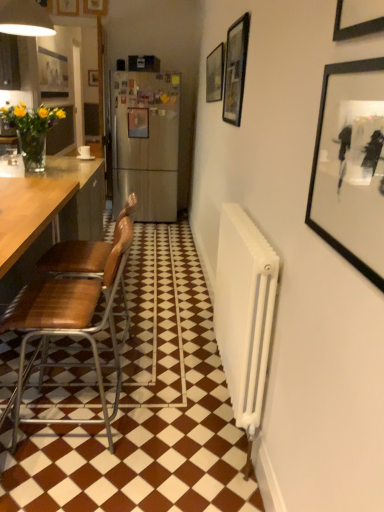
Question: In which direction should I rotate to look at matte black picture frame at upper center, acting as the second picture frame starting from the top?

Choices:
 (A) right
 (B) left

Answer: (B)

Question: Is metallic silver picture frame at center, which ranks as the 4th picture frame in front-to-back order, closer to the viewer compared to brown leather chair at left, positioned as the 1th chair in back-to-front order?

Choices:
 (A) no
 (B) yes

Answer: (A)

Question: From the image's perspective, does metallic silver picture frame at center, which is the 3th picture frame from left to right, appear lower than brown leather chair at left, positioned as the 2th chair in front-to-back order?

Choices:
 (A) no
 (B) yes

Answer: (A)

Question: Is there a large distance between metallic silver picture frame at center, the fourth picture frame from the bottom, and brown leather chair at left, positioned as the 2th chair in front-to-back order?

Choices:
 (A) yes
 (B) no

Answer: (A)

Question: Is metallic silver picture frame at center, the fourth picture frame from the bottom, aimed at brown leather chair at left, positioned as the 1th chair in back-to-front order?

Choices:
 (A) yes
 (B) no

Answer: (A)

Question: Does metallic silver picture frame at center, which ranks as the 4th picture frame in front-to-back order, appear on the right side of brown leather chair at left, positioned as the 2th chair in front-to-back order?

Choices:
 (A) no
 (B) yes

Answer: (A)

Question: From the image's perspective, is metallic silver picture frame at center, which is the 3th picture frame from left to right, over brown leather chair at left, positioned as the 1th chair in back-to-front order?

Choices:
 (A) no
 (B) yes

Answer: (B)

Question: Considering the relative sizes of brown leather chair at left, positioned as the 2th chair in front-to-back order, and brown leather chair at left, which is the second chair in back-to-front order, in the image provided, is brown leather chair at left, positioned as the 2th chair in front-to-back order, taller than brown leather chair at left, which is the second chair in back-to-front order,?

Choices:
 (A) yes
 (B) no

Answer: (A)

Question: Is brown leather chair at left, placed as the 1th chair when sorted from front to back, surrounded by brown leather chair at left, positioned as the 1th chair in back-to-front order?

Choices:
 (A) no
 (B) yes

Answer: (A)

Question: Considering the relative sizes of brown leather chair at left, positioned as the 1th chair in back-to-front order, and brown leather chair at left, placed as the 1th chair when sorted from front to back, in the image provided, is brown leather chair at left, positioned as the 1th chair in back-to-front order, thinner than brown leather chair at left, placed as the 1th chair when sorted from front to back,?

Choices:
 (A) no
 (B) yes

Answer: (B)

Question: Can you confirm if brown leather chair at left, positioned as the 1th chair in back-to-front order, is smaller than brown leather chair at left, placed as the 1th chair when sorted from front to back?

Choices:
 (A) no
 (B) yes

Answer: (A)

Question: Is brown leather chair at left, positioned as the 2th chair in front-to-back order, positioned with its back to brown leather chair at left, placed as the 1th chair when sorted from front to back?

Choices:
 (A) yes
 (B) no

Answer: (B)

Question: Is brown leather chair at left, positioned as the 2th chair in front-to-back order, positioned behind brown leather chair at left, placed as the 1th chair when sorted from front to back?

Choices:
 (A) no
 (B) yes

Answer: (B)

Question: Considering the relative positions of brown leather chair at left, positioned as the 2th chair in front-to-back order, and matte black picture frame at upper center, the 6th picture frame from the front, in the image provided, is brown leather chair at left, positioned as the 2th chair in front-to-back order, behind matte black picture frame at upper center, the 6th picture frame from the front,?

Choices:
 (A) no
 (B) yes

Answer: (A)